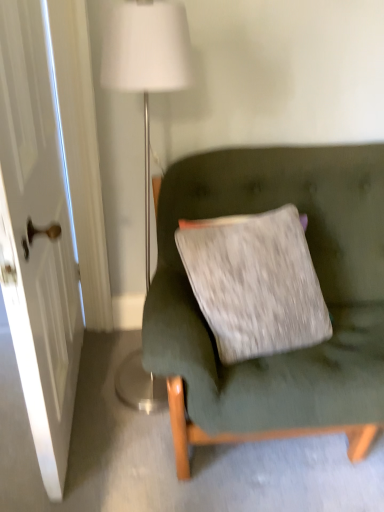
Question: Are velvet green couch at center and white glossy door at left beside each other?

Choices:
 (A) yes
 (B) no

Answer: (B)

Question: Can you confirm if velvet green couch at center is shorter than white glossy door at left?

Choices:
 (A) no
 (B) yes

Answer: (B)

Question: Can you confirm if velvet green couch at center is thinner than white glossy door at left?

Choices:
 (A) yes
 (B) no

Answer: (B)

Question: Are velvet green couch at center and white glossy door at left far apart?

Choices:
 (A) no
 (B) yes

Answer: (A)

Question: Is velvet green couch at center further to camera compared to white glossy door at left?

Choices:
 (A) no
 (B) yes

Answer: (B)

Question: Does velvet green couch at center turn towards white glossy door at left?

Choices:
 (A) yes
 (B) no

Answer: (B)

Question: Does white glossy door at left have a lesser height compared to white fabric lampshade at upper center?

Choices:
 (A) no
 (B) yes

Answer: (A)

Question: Is white glossy door at left at the left side of white fabric lampshade at upper center?

Choices:
 (A) no
 (B) yes

Answer: (B)

Question: Is white fabric lampshade at upper center at the back of white glossy door at left?

Choices:
 (A) yes
 (B) no

Answer: (A)

Question: From a real-world perspective, is white glossy door at left located beneath white fabric lampshade at upper center?

Choices:
 (A) yes
 (B) no

Answer: (B)

Question: Does white glossy door at left come in front of white fabric lampshade at upper center?

Choices:
 (A) yes
 (B) no

Answer: (A)

Question: From the image's perspective, is white glossy door at left located beneath white fabric lampshade at upper center?

Choices:
 (A) yes
 (B) no

Answer: (A)

Question: Is velvet green couch at center facing away from white fabric lampshade at upper center?

Choices:
 (A) yes
 (B) no

Answer: (B)